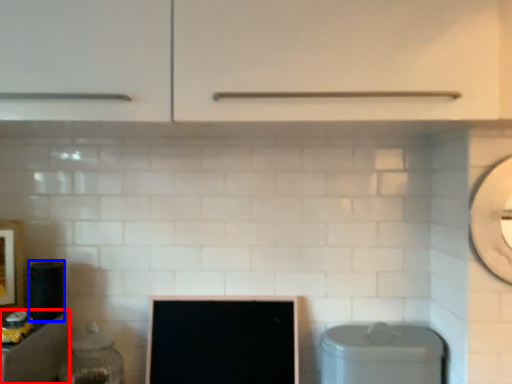
Question: Among these objects, which one is farthest to the camera, cabinetry (highlighted by a red box) or appliance (highlighted by a blue box)?

Choices:
 (A) cabinetry
 (B) appliance

Answer: (B)